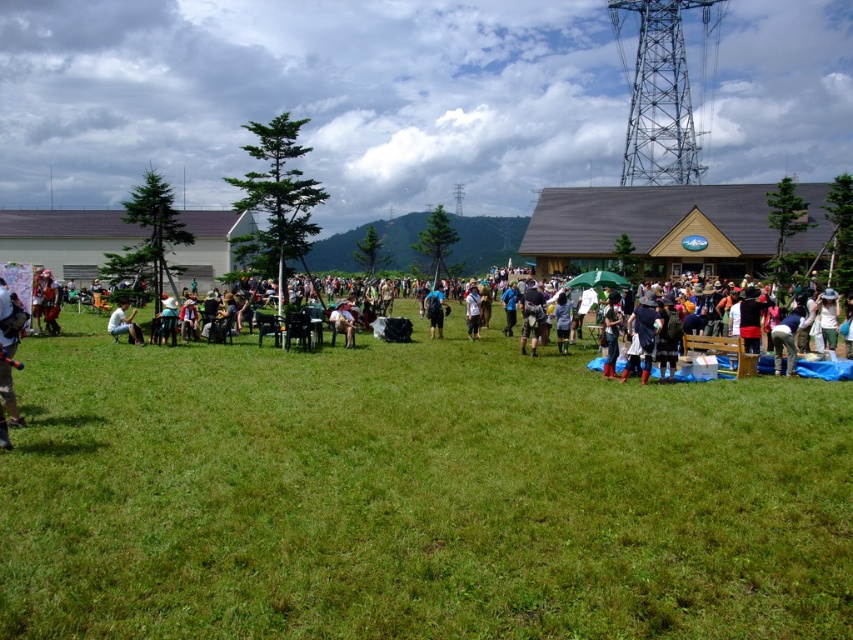
You are organizing a picnic and need to place a picnic basket on the ground. The basket requires a space larger than the matte black jacket at center. Based on the scene, can you determine if the green grass at center has enough space for the basket?

The green grass at center has a larger size compared to the matte black jacket at center, so yes, the picnic basket can be placed there as it provides sufficient space.

You are standing at the edge of the field and want to walk towards the green grass at center. However, there is a matte black jacket at center in your path. Which direction should you move to avoid it?

The green grass at center is to the right of matte black jacket at center, so you should move to the right to avoid the matte black jacket at center and reach the green grass at center.

You are a photographer trying to capture a photo of the matte black jacket at left and the light brown fabric chair at center. Since you want to ensure both are clearly visible in the frame, which object should you focus on first to avoid blurring due to their height difference?

The matte black jacket at left is much taller than the light brown fabric chair at center. To ensure both are in focus, you should focus on the matte black jacket at left first as it is taller and might require more precise focus to capture details without blurring.